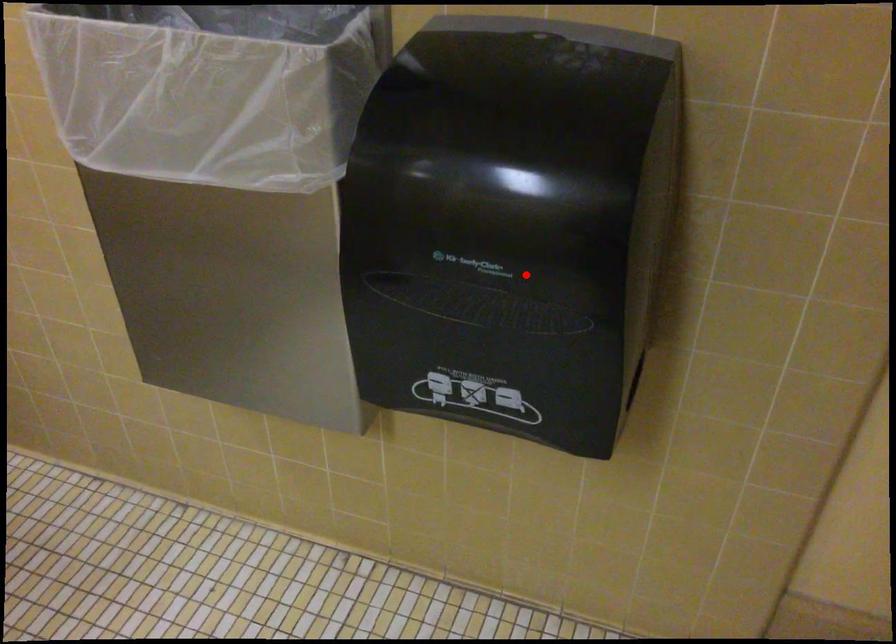
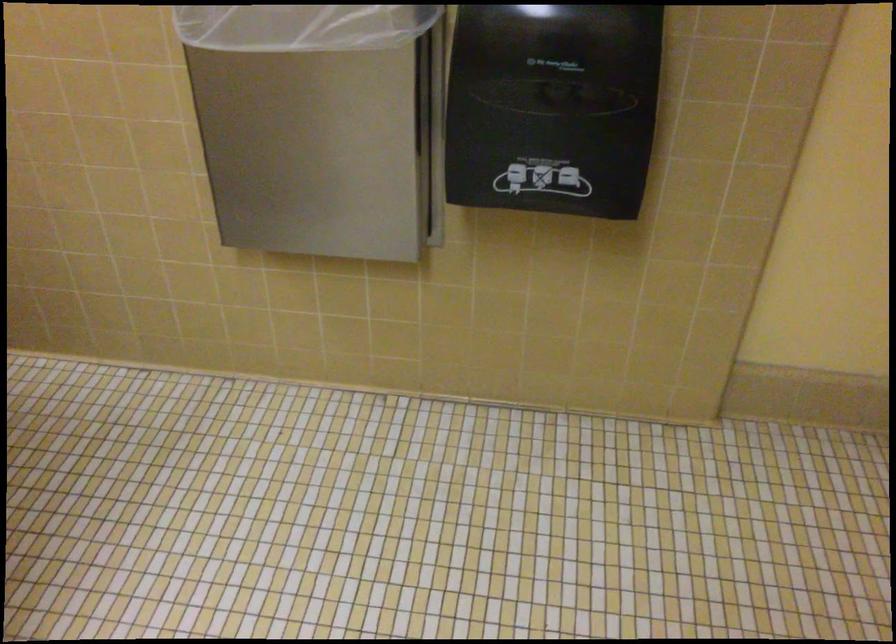
Question: I am providing you with two images of the same scene from different viewpoints. Image1 has a red point marked. In image2, the corresponding 3D location appears at what relative position? Reply with the corresponding letter.

Choices:
 (A) Closer
 (B) Farther

Answer: (B)